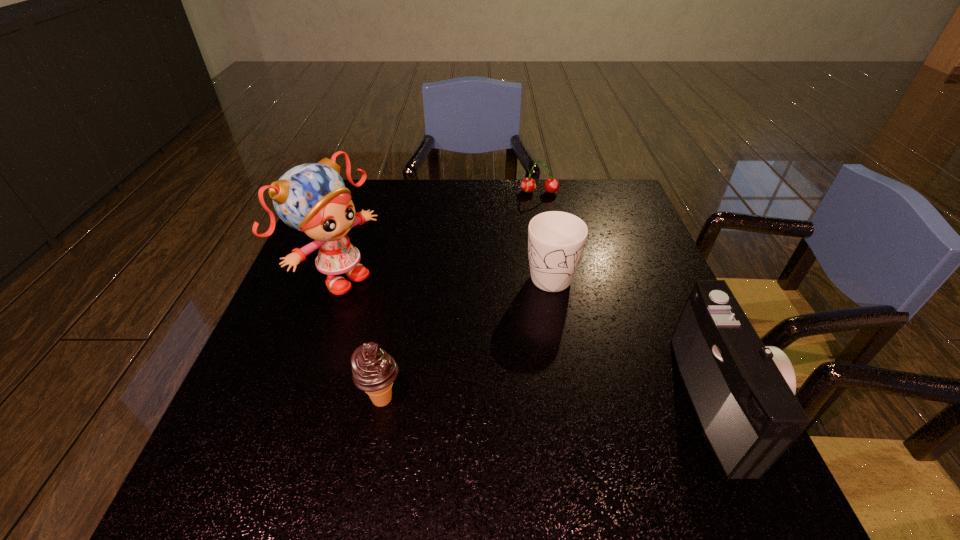
Identify the location of free space on the desktop that is between the icecream and the camcorder and is positioned on the side of the mug with the handle. Image resolution: width=960 pixels, height=540 pixels. (573, 400).

This screenshot has width=960, height=540. In order to click on vacant space on the desktop that is between the icecream and the rightmost object and is positioned on the face of the doll in this screenshot , I will do `click(543, 400)`.

I want to click on free space on the desktop that is between the icecream and the rightmost object and is positioned with stems pointing upwards on the cherry, so click(x=550, y=400).